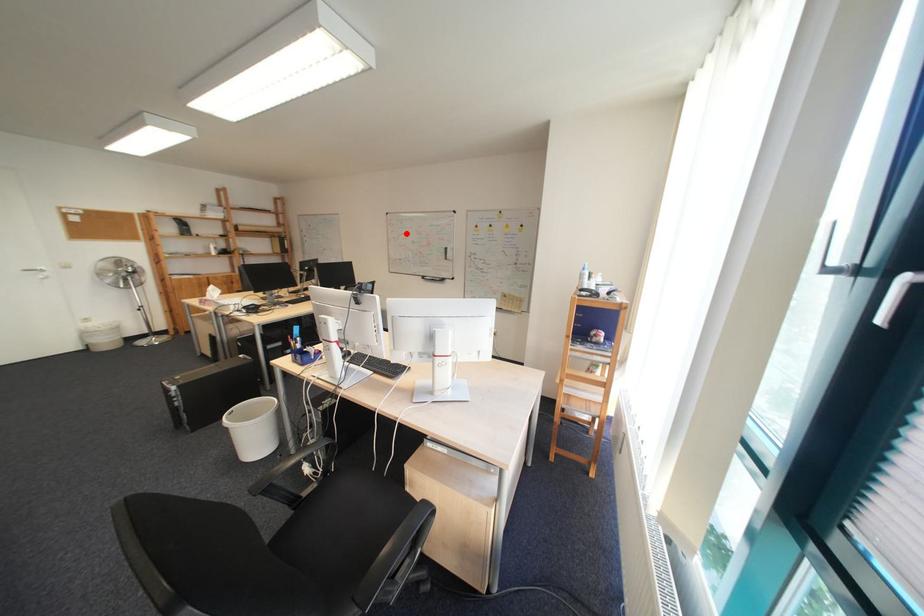
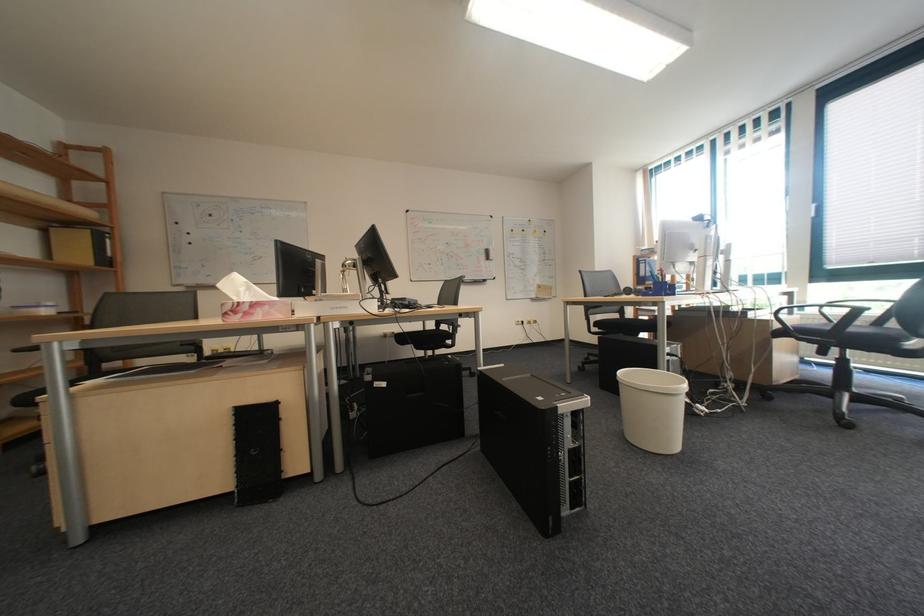
Where in the second image is the point corresponding to the highlighted location from the first image?

(431, 233)